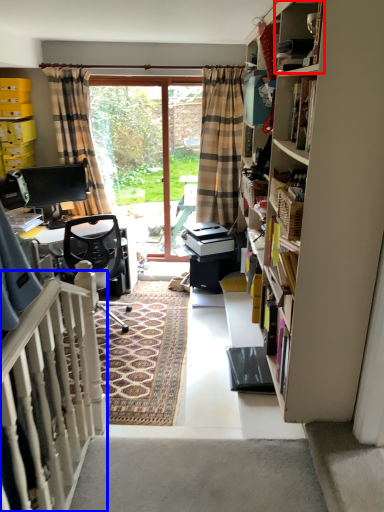
Question: Which point is closer to the camera, cabinet (highlighted by a red box) or balustrade (highlighted by a blue box)?

Choices:
 (A) cabinet
 (B) balustrade

Answer: (B)